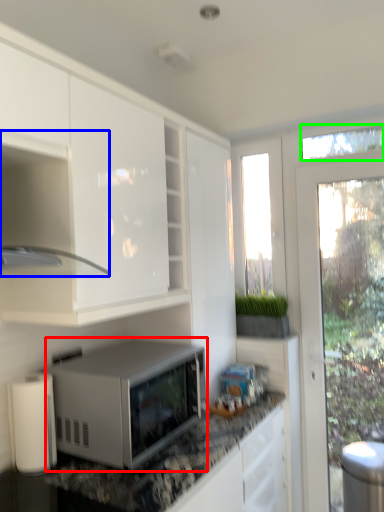
Question: Which is farther away from microwave oven (highlighted by a red box)? cabinetry (highlighted by a blue box) or window screen (highlighted by a green box)?

Choices:
 (A) cabinetry
 (B) window screen

Answer: (B)